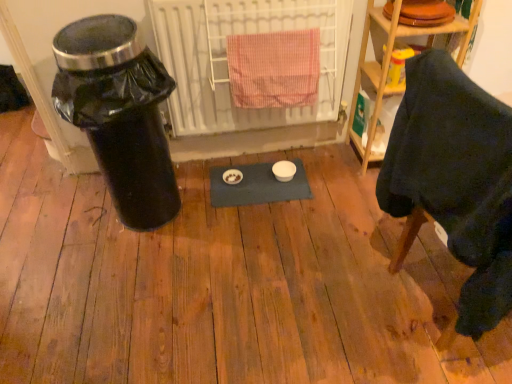
Where is `free point below dark fabric chair at lower right (from a real-world perspective)`? This screenshot has width=512, height=384. free point below dark fabric chair at lower right (from a real-world perspective) is located at coordinates (429, 290).